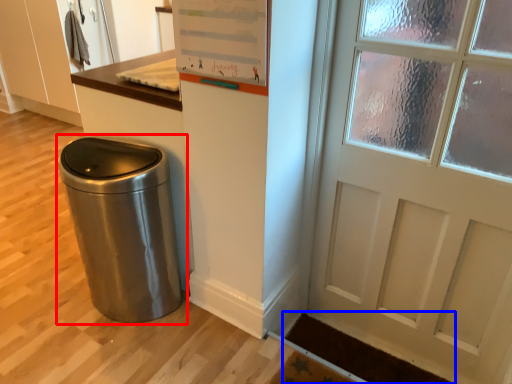
Question: Which point is closer to the camera, waste container (highlighted by a red box) or doormat (highlighted by a blue box)?

Choices:
 (A) waste container
 (B) doormat

Answer: (A)